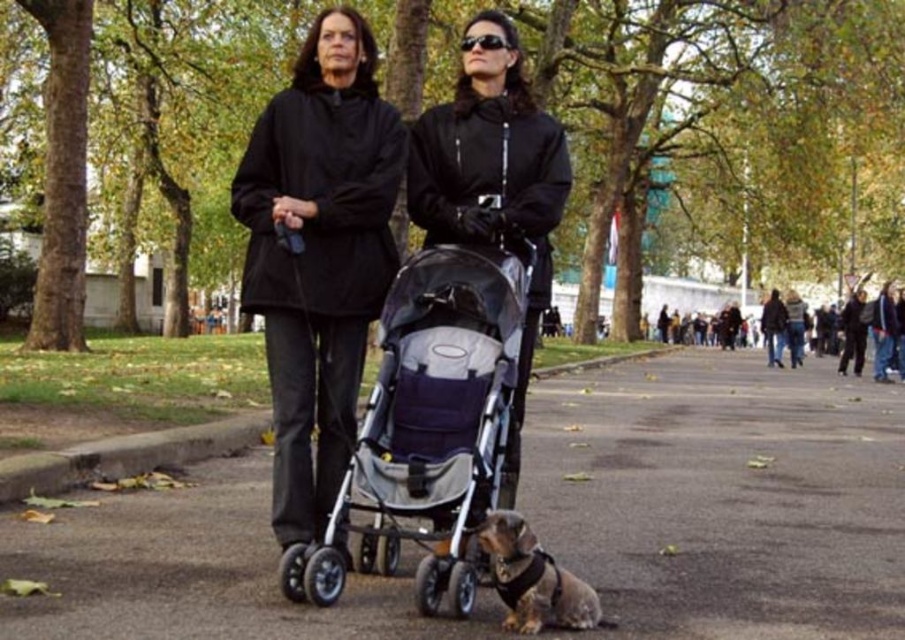
Question: Is metallic stroller at center further to camera compared to black matte coat at center?

Choices:
 (A) no
 (B) yes

Answer: (A)

Question: Which point is farther from the camera taking this photo?

Choices:
 (A) (500, 544)
 (B) (427, 490)
 (C) (436, 115)
 (D) (291, 205)

Answer: (C)

Question: Which of the following is the farthest from the observer?

Choices:
 (A) black plastic sunglasses at center
 (B) brown fur dog at lower center
 (C) black matte coat at center
 (D) matte black stroller at center

Answer: (A)

Question: Among these objects, which one is nearest to the camera?

Choices:
 (A) silver metallic stroller at center
 (B) metallic stroller at center
 (C) black plastic sunglasses at center
 (D) brown fur dog at lower center

Answer: (B)

Question: Can you confirm if brown fur dog at lower center is positioned below black plastic sunglasses at center?

Choices:
 (A) yes
 (B) no

Answer: (A)

Question: Is the position of silver metallic stroller at center more distant than that of brown fur dog at lower center?

Choices:
 (A) no
 (B) yes

Answer: (B)